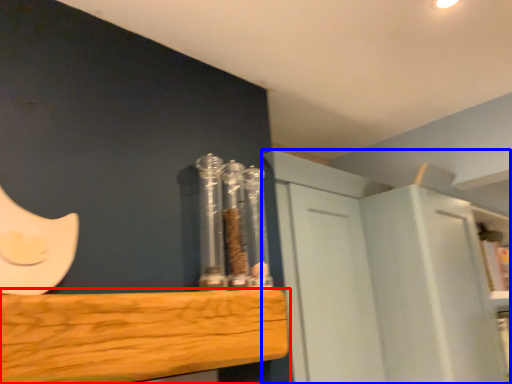
Question: Which object is further to the camera taking this photo, furniture (highlighted by a red box) or cabinetry (highlighted by a blue box)?

Choices:
 (A) furniture
 (B) cabinetry

Answer: (B)